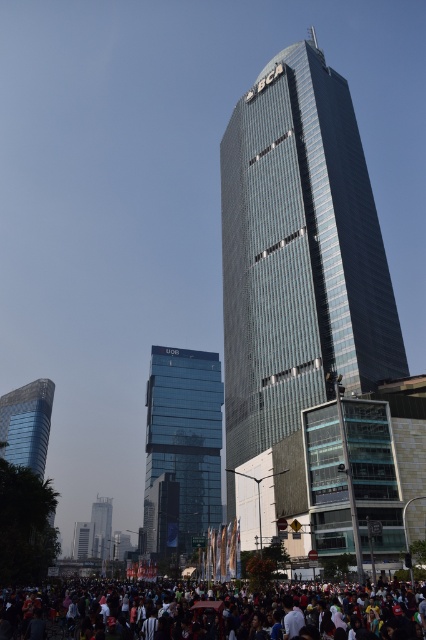
Is point (160, 550) in front of point (39, 394)?

Yes, point (160, 550) is in front of point (39, 394).

Does transparent glass building at center have a larger size compared to shiny glass skyscraper at left?

No, transparent glass building at center is not bigger than shiny glass skyscraper at left.

Who is more forward, (169,372) or (13,422)?

Point (169,372) is in front.

Identify the location of transparent glass building at center. The height and width of the screenshot is (640, 426). (181, 449).

Who is more forward, [314,625] or [109,524]?

Positioned in front is point [314,625].

Does point (245, 605) come farther from viewer compared to point (95, 532)?

No, it is not.

Locate an element on the screen. multicolored fabric crowd at lower center is located at coordinates (138, 616).

In the scene shown: Which is above, multicolored fabric crowd at lower center or transparent glass building at center?

multicolored fabric crowd at lower center

Between point (210, 630) and point (219, 458), which one is positioned behind?

The point (219, 458) is more distant.

Is point (66, 588) farther from camera compared to point (184, 358)?

No, it is in front of (184, 358).

At what (x,y) coordinates should I click in order to perform the action: click on multicolored fabric crowd at lower center. Please return your answer as a coordinate pair (x, y). The image size is (426, 640). Looking at the image, I should click on (138, 616).